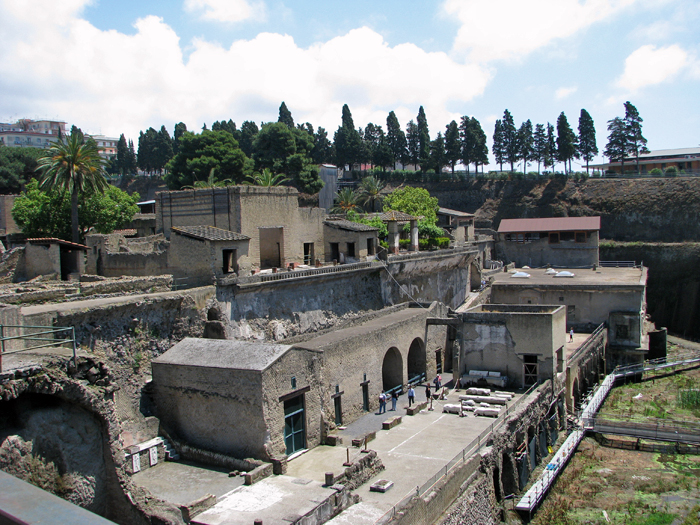
The height and width of the screenshot is (525, 700). Find the location of `support posts`. support posts is located at coordinates (393, 235), (416, 238).